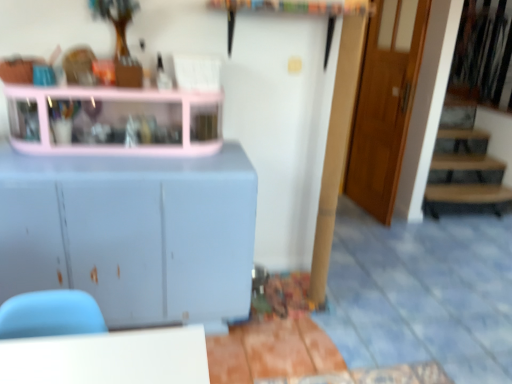
Describe the element at coordinates (119, 120) in the screenshot. I see `pink plastic shelf at upper left` at that location.

Identify the location of wooden door at right. (385, 104).

You are a GUI agent. You are given a task and a screenshot of the screen. Output one action in this format:
    pyautogui.click(x=<x>, y=<y>)
    Task: Click on the matte white cabinet at left
    
    Given the screenshot: What is the action you would take?
    pyautogui.click(x=132, y=233)

From a real-world perspective, is wooden door at right located higher than matte white cabinet at left?

Yes, from a real-world perspective, wooden door at right is on top of matte white cabinet at left.

Are wooden door at right and matte white cabinet at left far apart?

Indeed, wooden door at right is not near matte white cabinet at left.

From the image's perspective, is wooden door at right below matte white cabinet at left?

Actually, wooden door at right appears above matte white cabinet at left in the image.

Is wooden door at right oriented away from matte white cabinet at left?

No, matte white cabinet at left is not at the back of wooden door at right.

Which point is more forward, [170,212] or [379,1]?

The point [170,212] is closer.

Which object is more forward, matte white cabinet at left or wooden door at right?

matte white cabinet at left is closer to the camera.

Which is more to the right, matte white cabinet at left or wooden door at right?

wooden door at right is more to the right.

Is pink plastic shelf at upper left not inside matte white cabinet at left?

pink plastic shelf at upper left is positioned outside matte white cabinet at left.

Looking at this image, what's the angular difference between pink plastic shelf at upper left and matte white cabinet at left's facing directions?

The angle between the facing direction of pink plastic shelf at upper left and the facing direction of matte white cabinet at left is 0.287 degrees.

You are a GUI agent. You are given a task and a screenshot of the screen. Output one action in this format:
    pyautogui.click(x=<x>, y=<y>)
    Task: Click on the shelf located above the matte white cabinet at left (from a real-world perspective)
    The width and height of the screenshot is (512, 384).
    Given the screenshot: What is the action you would take?
    pyautogui.click(x=119, y=120)

Does pink plastic shelf at upper left lie behind matte white cabinet at left?

Yes, pink plastic shelf at upper left is further from the viewer.

Consider the image. Is pink plastic shelf at upper left situated inside wooden door at right or outside?

pink plastic shelf at upper left is spatially situated outside wooden door at right.

Which of these two, pink plastic shelf at upper left or wooden door at right, stands taller?

wooden door at right is taller.

From the image's perspective, which object appears higher, pink plastic shelf at upper left or wooden door at right?

wooden door at right, from the image's perspective.

Which of these two, pink plastic shelf at upper left or wooden door at right, is bigger?

wooden door at right is bigger.

Measure the distance between wooden door at right and pink plastic shelf at upper left.

wooden door at right is 6.32 feet away from pink plastic shelf at upper left.

Between wooden door at right and pink plastic shelf at upper left, which one has larger width?

With larger width is pink plastic shelf at upper left.

Is point (392, 127) positioned before point (29, 152)?

No, it is not.

From a real-world perspective, which is physically above, wooden door at right or pink plastic shelf at upper left?

In real-world perspective, pink plastic shelf at upper left is above.

Considering the sizes of objects matte white cabinet at left and pink plastic shelf at upper left in the image provided, who is smaller, matte white cabinet at left or pink plastic shelf at upper left?

pink plastic shelf at upper left.

Is matte white cabinet at left taller or shorter than pink plastic shelf at upper left?

Clearly, matte white cabinet at left is taller compared to pink plastic shelf at upper left.

Where is `cabinetry that appears on the left of pink plastic shelf at upper left`? cabinetry that appears on the left of pink plastic shelf at upper left is located at coordinates (132, 233).

From a real-world perspective, is matte white cabinet at left beneath pink plastic shelf at upper left?

Yes, from a real-world perspective, matte white cabinet at left is under pink plastic shelf at upper left.

Find the location of a particular element. This screenshot has width=512, height=384. door that appears above the matte white cabinet at left (from a real-world perspective) is located at coordinates (385, 104).

This screenshot has width=512, height=384. Identify the location of cabinetry below the wooden door at right (from a real-world perspective). (132, 233).

Considering their positions, is matte white cabinet at left positioned further to wooden door at right than pink plastic shelf at upper left?

The object further to wooden door at right is matte white cabinet at left.

Based on their spatial positions, is pink plastic shelf at upper left or matte white cabinet at left further from wooden door at right?

The object further to wooden door at right is matte white cabinet at left.

Based on their spatial positions, is matte white cabinet at left or wooden door at right further from pink plastic shelf at upper left?

wooden door at right.

Which object lies nearer to the anchor point matte white cabinet at left, pink plastic shelf at upper left or wooden door at right?

pink plastic shelf at upper left lies closer to matte white cabinet at left than the other object.

Looking at this image, estimate the real-world distances between objects in this image. Which object is closer to pink plastic shelf at upper left, wooden door at right or matte white cabinet at left?

matte white cabinet at left lies closer to pink plastic shelf at upper left than the other object.

From the image, which object appears to be nearer to matte white cabinet at left, wooden door at right or pink plastic shelf at upper left?

The object closer to matte white cabinet at left is pink plastic shelf at upper left.

Locate an element on the screen. shelf between matte white cabinet at left and wooden door at right from left to right is located at coordinates (x=119, y=120).